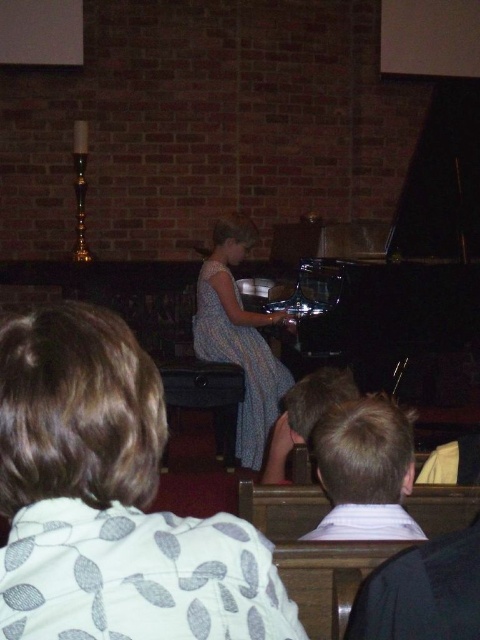
This screenshot has height=640, width=480. Describe the element at coordinates (110, 500) in the screenshot. I see `matte gray dress at center` at that location.

Does matte gray dress at center come behind blue dotted fabric dress at center?

No, matte gray dress at center is in front of blue dotted fabric dress at center.

Who is more distant from viewer, (112, 429) or (218, 358)?

Point (218, 358)

Where is `matte gray dress at center`? The height and width of the screenshot is (640, 480). matte gray dress at center is located at coordinates click(x=110, y=500).

From the picture: Is black polished piano at center wider than blue dotted fabric dress at center?

Yes.

Who is positioned more to the right, black polished piano at center or blue dotted fabric dress at center?

black polished piano at center

Measure the distance between point (476,216) and camera.

3.29 meters

At what (x,y) coordinates should I click in order to perform the action: click on black polished piano at center. Please return your answer as a coordinate pair (x, y). The height and width of the screenshot is (640, 480). Looking at the image, I should click on (407, 269).

Based on the photo, who is shorter, matte gray dress at center or black polished piano at center?

matte gray dress at center

Does matte gray dress at center appear under black polished piano at center?

Indeed, matte gray dress at center is positioned under black polished piano at center.

Who is more forward, [279,609] or [271,307]?

Positioned in front is point [279,609].

Identify the location of matte gray dress at center. The image size is (480, 640). (110, 500).